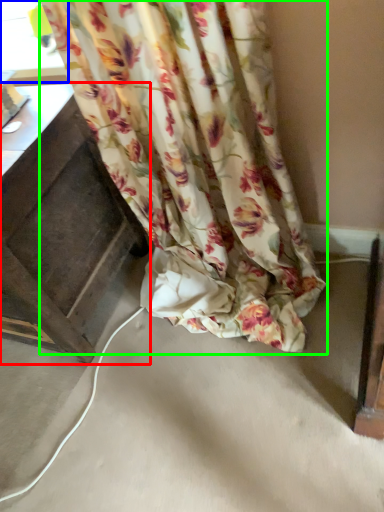
Question: Based on their relative distances, which object is nearer to furniture (highlighted by a red box)? Choose from window (highlighted by a blue box) and curtain (highlighted by a green box).

Choices:
 (A) window
 (B) curtain

Answer: (B)